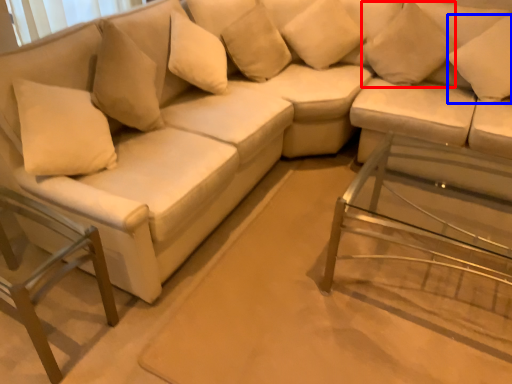
Question: Which of the following is the farthest to the observer, pillow (highlighted by a red box) or pillow (highlighted by a blue box)?

Choices:
 (A) pillow
 (B) pillow

Answer: (A)